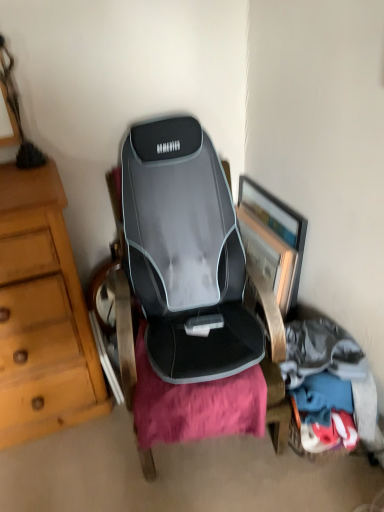
What do you see at coordinates (328, 386) in the screenshot? The image size is (384, 512). I see `soft cotton clothes at lower right` at bounding box center [328, 386].

Measure the distance between soft cotton clothes at lower right and camera.

soft cotton clothes at lower right is 4.52 feet from camera.

Where is `soft cotton clothes at lower right`? The image size is (384, 512). soft cotton clothes at lower right is located at coordinates (328, 386).

Image resolution: width=384 pixels, height=512 pixels. Identify the location of wooden framed picture at center right. (272, 239).

Describe the element at coordinates (272, 239) in the screenshot. I see `wooden framed picture at center right` at that location.

Locate an element on the screen. The image size is (384, 512). soft cotton clothes at lower right is located at coordinates (328, 386).

Visually, is wooden framed picture at center right positioned to the left or to the right of soft cotton clothes at lower right?

wooden framed picture at center right is to the left of soft cotton clothes at lower right.

Is wooden framed picture at center right positioned before soft cotton clothes at lower right?

No.

Which point is more forward, (286, 237) or (337, 394)?

The point (337, 394) is closer.

From the image's perspective, which is below, wooden framed picture at center right or soft cotton clothes at lower right?

soft cotton clothes at lower right.

From a real-world perspective, which is physically above, wooden framed picture at center right or soft cotton clothes at lower right?

wooden framed picture at center right, from a real-world perspective.

Which object is thinner, wooden framed picture at center right or soft cotton clothes at lower right?

With smaller width is soft cotton clothes at lower right.

Does wooden framed picture at center right have a greater height compared to soft cotton clothes at lower right?

Indeed, wooden framed picture at center right has a greater height compared to soft cotton clothes at lower right.

Considering the sizes of objects wooden framed picture at center right and soft cotton clothes at lower right in the image provided, who is bigger, wooden framed picture at center right or soft cotton clothes at lower right?

soft cotton clothes at lower right.

Would you say wooden framed picture at center right is inside or outside soft cotton clothes at lower right?

wooden framed picture at center right is not enclosed by soft cotton clothes at lower right.

Is wooden framed picture at center right beside soft cotton clothes at lower right?

No, wooden framed picture at center right is not making contact with soft cotton clothes at lower right.

Is wooden framed picture at center right turned away from soft cotton clothes at lower right?

wooden framed picture at center right is not turned away from soft cotton clothes at lower right.

Identify the location of picture frame that appears on the left of soft cotton clothes at lower right. Image resolution: width=384 pixels, height=512 pixels. point(272,239).

Is soft cotton clothes at lower right to the right of wooden framed picture at center right from the viewer's perspective?

Indeed, soft cotton clothes at lower right is positioned on the right side of wooden framed picture at center right.

Consider the image. Relative to wooden framed picture at center right, is soft cotton clothes at lower right in front or behind?

Visually, soft cotton clothes at lower right is located in front of wooden framed picture at center right.

Does point (334, 388) appear closer or farther from the camera than point (269, 211)?

Point (334, 388) is positioned closer to the camera compared to point (269, 211).

From the image's perspective, is soft cotton clothes at lower right above wooden framed picture at center right?

No, from the image's perspective, soft cotton clothes at lower right is not on top of wooden framed picture at center right.

From a real-world perspective, is soft cotton clothes at lower right on top of wooden framed picture at center right?

No.

Can you confirm if soft cotton clothes at lower right is thinner than wooden framed picture at center right?

Correct, the width of soft cotton clothes at lower right is less than that of wooden framed picture at center right.

Can you confirm if soft cotton clothes at lower right is shorter than wooden framed picture at center right?

Yes.

Between soft cotton clothes at lower right and wooden framed picture at center right, which one has larger size?

With larger size is soft cotton clothes at lower right.

Is soft cotton clothes at lower right inside or outside of wooden framed picture at center right?

soft cotton clothes at lower right lies outside wooden framed picture at center right.

Is soft cotton clothes at lower right with wooden framed picture at center right?

No, soft cotton clothes at lower right is not in contact with wooden framed picture at center right.

Is soft cotton clothes at lower right aimed at wooden framed picture at center right?

No, soft cotton clothes at lower right is not aimed at wooden framed picture at center right.

Find the location of a particular element. picture frame on the left of soft cotton clothes at lower right is located at coordinates (272, 239).

At what (x,y) coordinates should I click in order to perform the action: click on picture frame above the soft cotton clothes at lower right (from a real-world perspective). Please return your answer as a coordinate pair (x, y). This screenshot has height=512, width=384. Looking at the image, I should click on (272, 239).

Image resolution: width=384 pixels, height=512 pixels. I want to click on picture frame that is above the soft cotton clothes at lower right (from the image's perspective), so click(x=272, y=239).